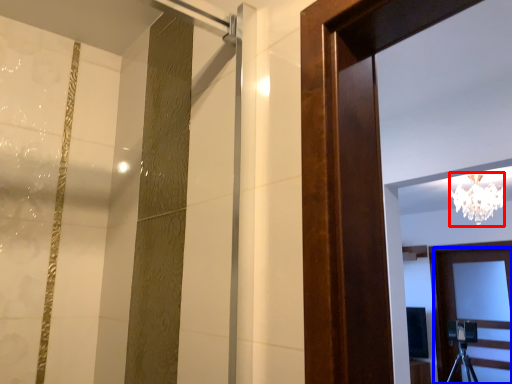
Question: Which of the following is the closest to the observer, lamp (highlighted by a red box) or door (highlighted by a blue box)?

Choices:
 (A) lamp
 (B) door

Answer: (A)